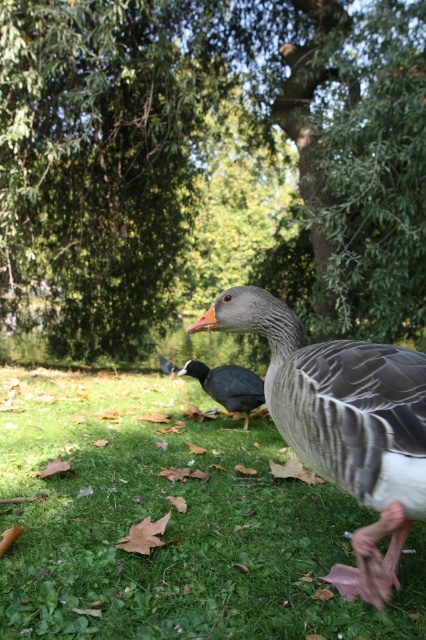
Which of these two, green grassy at lower center or black glossy duckling at center, stands shorter?

With less height is green grassy at lower center.

Who is taller, green grassy at lower center or black glossy duckling at center?

black glossy duckling at center

The image size is (426, 640). What do you see at coordinates (170, 522) in the screenshot?
I see `green grassy at lower center` at bounding box center [170, 522].

You are a GUI agent. You are given a task and a screenshot of the screen. Output one action in this format:
    pyautogui.click(x=<x>, y=<y>)
    Task: Click on the green grassy at lower center
    The image size is (426, 640).
    Given the screenshot: What is the action you would take?
    pyautogui.click(x=170, y=522)

In the scene shown: Which of these two, green leafy tree at center or gray feathered duck at center, stands taller?

green leafy tree at center is taller.

Consider the image. Which is above, green leafy tree at center or gray feathered duck at center?

green leafy tree at center is above.

Is point (100, 269) behind point (351, 388)?

That is True.

Where is `green leafy tree at center`? green leafy tree at center is located at coordinates (209, 168).

Is gray feathered duck at center closer to camera compared to black glossy duckling at center?

Yes, it is in front of black glossy duckling at center.

Is point (409, 509) farther from camera compared to point (170, 362)?

No, (409, 509) is closer to viewer.

What do you see at coordinates (344, 419) in the screenshot? I see `gray feathered duck at center` at bounding box center [344, 419].

Where is `gray feathered duck at center`? This screenshot has height=640, width=426. gray feathered duck at center is located at coordinates (344, 419).